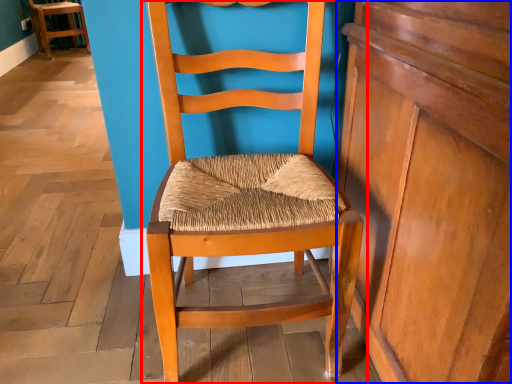
Question: Among these objects, which one is nearest to the camera, chair (highlighted by a red box) or dresser (highlighted by a blue box)?

Choices:
 (A) chair
 (B) dresser

Answer: (B)